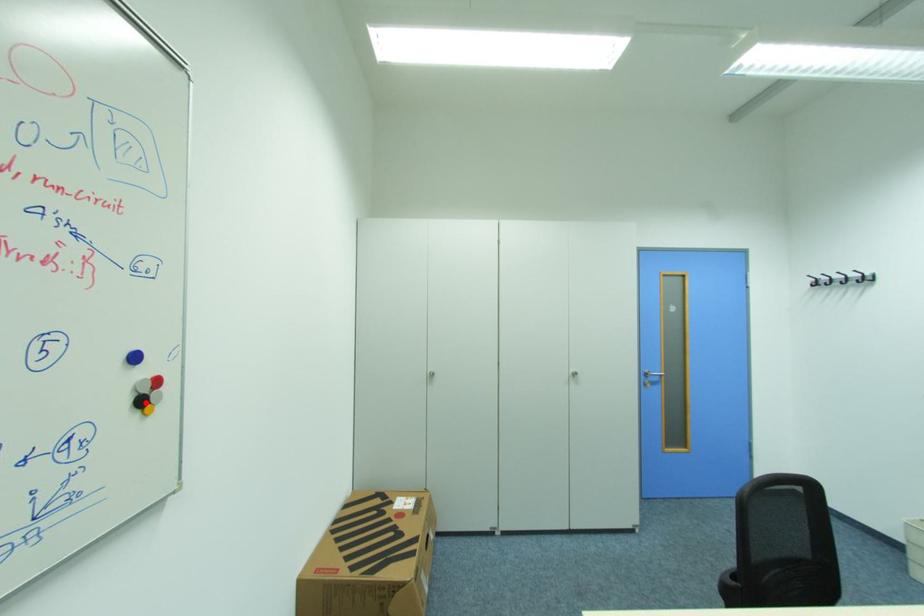
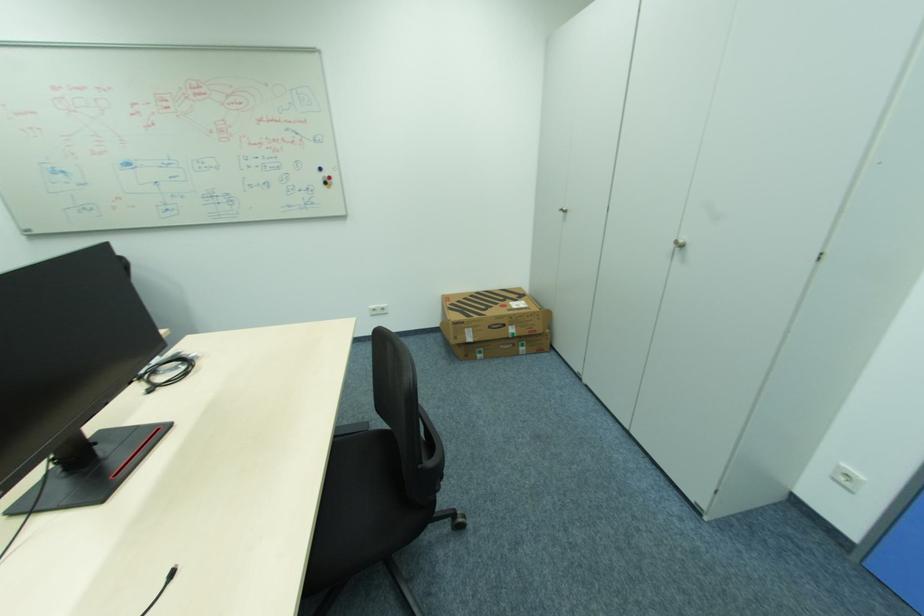
Question: I am providing you with two images of the same scene from different viewpoints. A red point is marked on the first image. At the location where the point appears in image 1, is it still visible in image 2?

Choices:
 (A) Yes
 (B) No

Answer: (A)